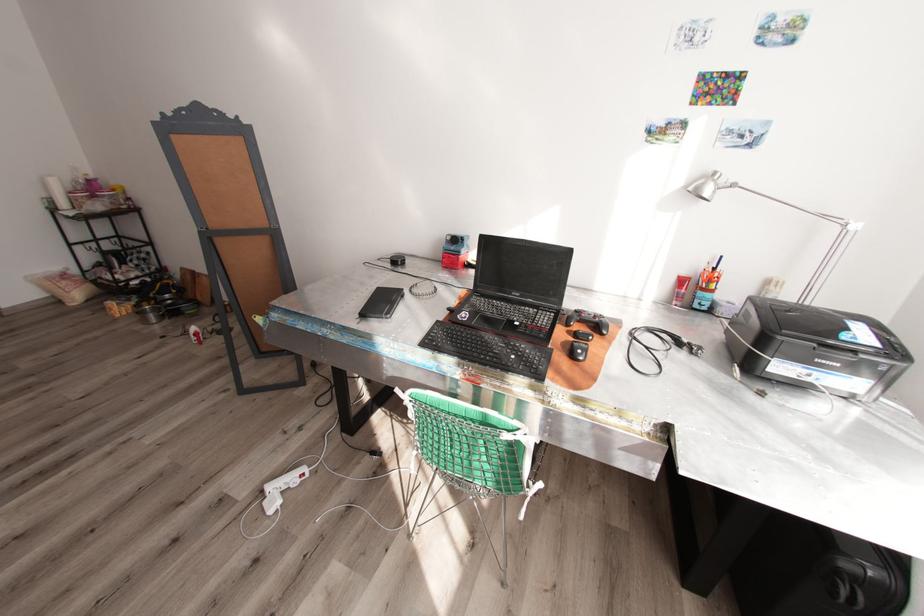
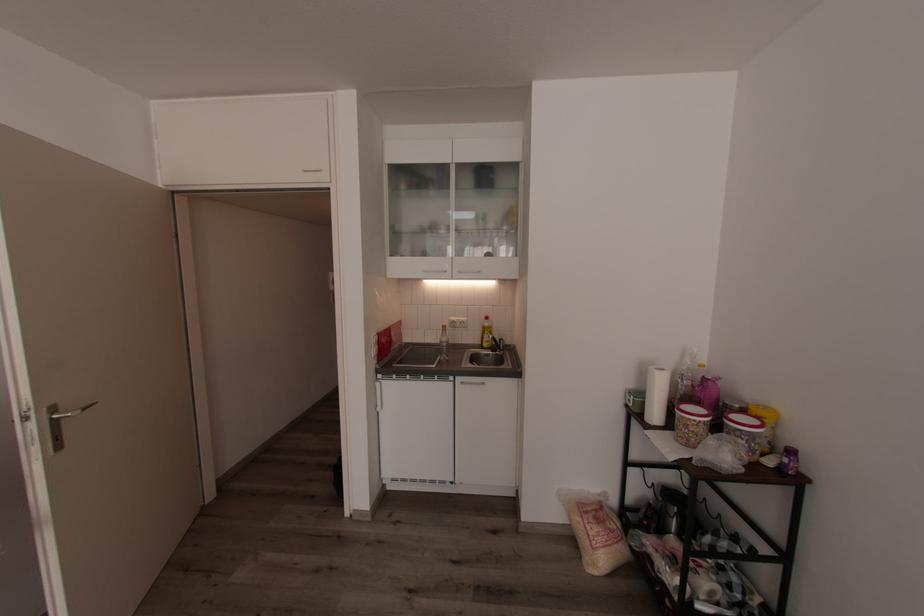
Question: I am providing you with two images of the same scene from different viewpoints. Please identify which objects are invisible in image2.

Choices:
 (A) silver cabinet handle
 (B) yellow food container
 (C) glass bottle
 (D) none of these

Answer: (D)